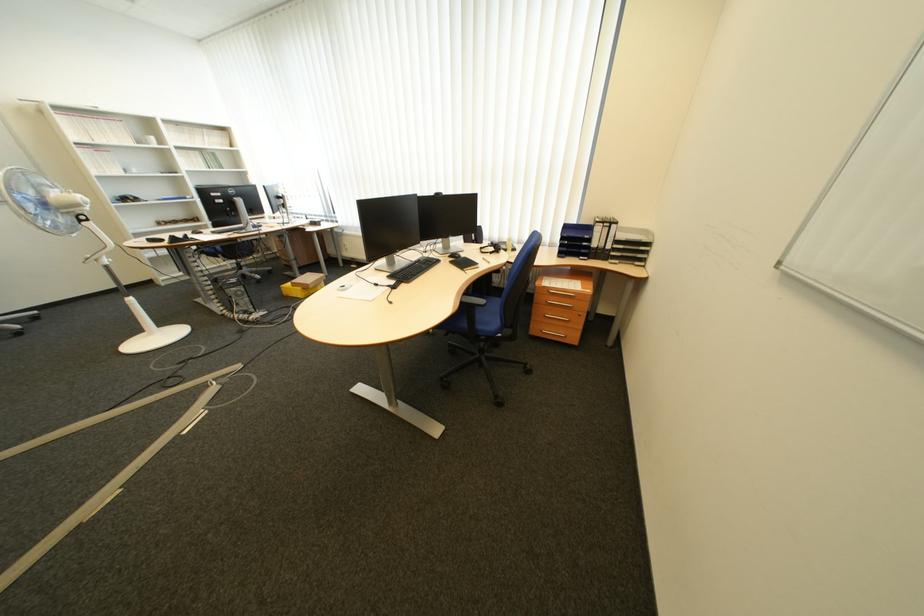
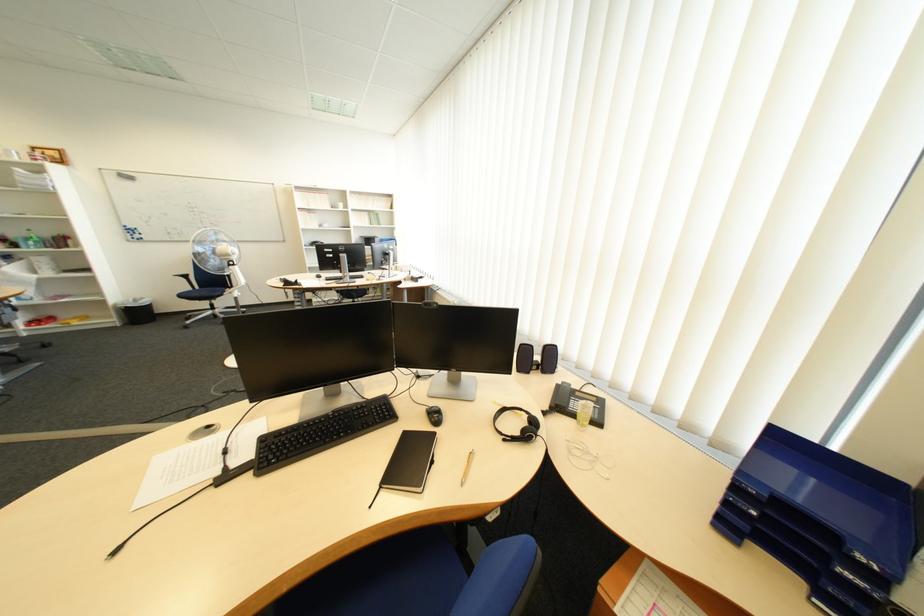
Find the pixel in the second image that matches (x=487, y=245) in the first image.

(551, 370)